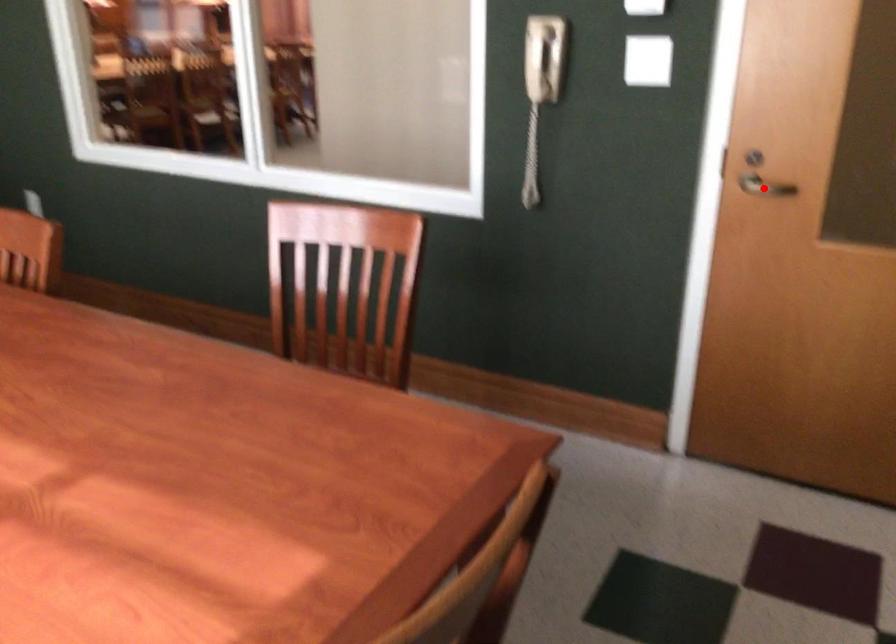
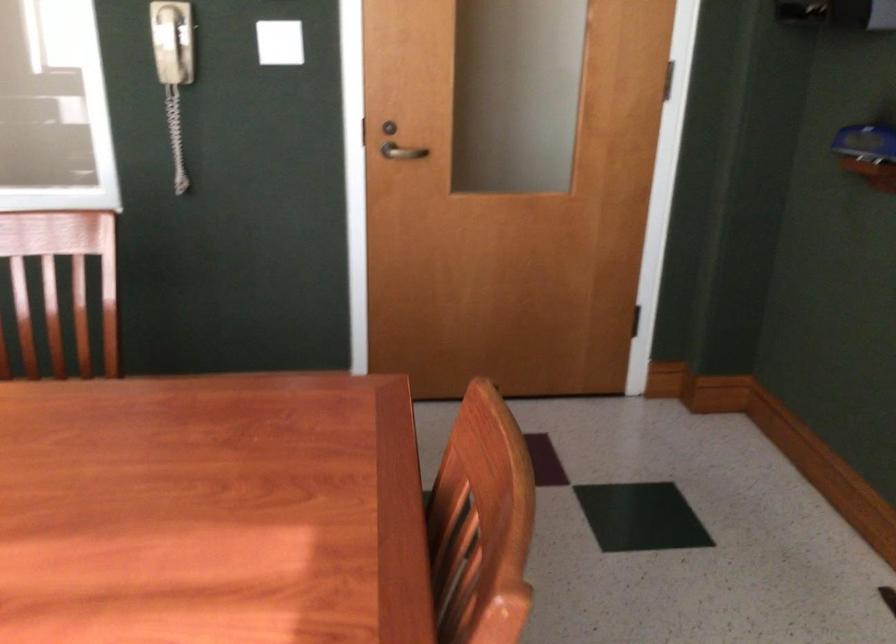
Find the pixel in the second image that matches the highlighted location in the first image.

(401, 152)